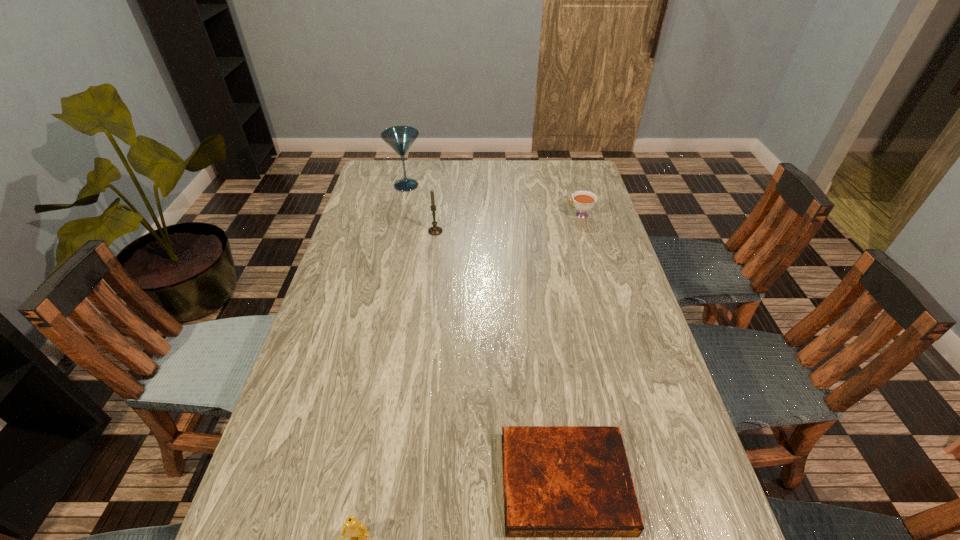
The width and height of the screenshot is (960, 540). In the image, there is a desktop. In order to click on vacant area at the right edge in this screenshot , I will do `click(622, 333)`.

Find the location of a particular element. free spot at the far left corner of the desktop is located at coordinates (392, 176).

Find the location of `blank space at the far right corner`. blank space at the far right corner is located at coordinates (559, 170).

Identify the location of vacant area between the martini and the shortest object. (486, 334).

Identify the location of vacant area that lies between the tallest object and the third object from right to left. The image size is (960, 540). (420, 208).

Where is `free spot between the tallest object and the third object from left to right`? The height and width of the screenshot is (540, 960). free spot between the tallest object and the third object from left to right is located at coordinates (420, 208).

Locate an element on the screen. This screenshot has height=540, width=960. vacant space that's between the farthest object and the second farthest object is located at coordinates (493, 200).

What are the coordinates of `blank region between the farthest object and the second farthest object` in the screenshot? It's located at (493, 200).

Where is `free space between the third farthest object and the farthest object`? free space between the third farthest object and the farthest object is located at coordinates (420, 208).

Image resolution: width=960 pixels, height=540 pixels. I want to click on free point between the teacup and the candle, so click(x=508, y=223).